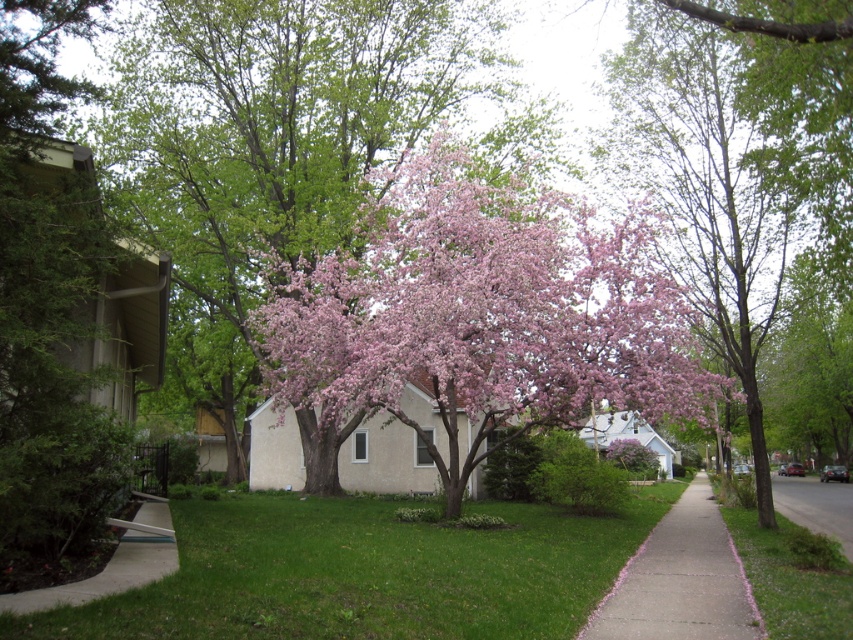
Question: Which point is closer to the camera?

Choices:
 (A) green matte tree at left
 (B) pink petal-covered sidewalk at center-right
 (C) asphalt pavement at lower right

Answer: (A)

Question: Can you confirm if pink bloom tree at center is positioned above pink blossoming tree at center?

Choices:
 (A) yes
 (B) no

Answer: (A)

Question: Among these points, which one is farthest from the camera?

Choices:
 (A) (448, 221)
 (B) (722, 548)
 (C) (650, 177)
 (D) (131, 288)

Answer: (C)

Question: Does pink petal-covered sidewalk at center-right have a greater width compared to asphalt pavement at lower right?

Choices:
 (A) no
 (B) yes

Answer: (A)

Question: Is green matte tree at left above asphalt pavement at lower right?

Choices:
 (A) yes
 (B) no

Answer: (A)

Question: Which point appears farthest from the camera in this image?

Choices:
 (A) (648, 112)
 (B) (653, 563)
 (C) (839, 490)
 (D) (646, 394)

Answer: (C)